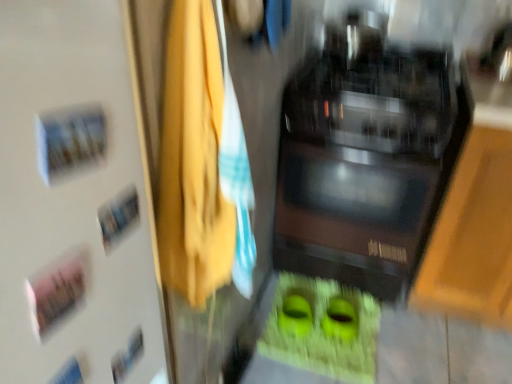
Question: Is yellow fabric at center located outside black glossy microwave at center?

Choices:
 (A) yes
 (B) no

Answer: (A)

Question: From a real-world perspective, is yellow fabric at center positioned over black glossy microwave at center based on gravity?

Choices:
 (A) yes
 (B) no

Answer: (A)

Question: Is yellow fabric at center turned away from black glossy microwave at center?

Choices:
 (A) no
 (B) yes

Answer: (A)

Question: From the image's perspective, is yellow fabric at center on black glossy microwave at center?

Choices:
 (A) no
 (B) yes

Answer: (A)

Question: Considering the relative sizes of yellow fabric at center and black glossy microwave at center in the image provided, is yellow fabric at center wider than black glossy microwave at center?

Choices:
 (A) yes
 (B) no

Answer: (B)

Question: Considering the positions of black glossy microwave at center and white matte door at upper left in the image, is black glossy microwave at center wider or thinner than white matte door at upper left?

Choices:
 (A) thin
 (B) wide

Answer: (B)

Question: Considering their positions, is black glossy microwave at center located in front of or behind white matte door at upper left?

Choices:
 (A) behind
 (B) front

Answer: (A)

Question: In terms of height, does black glossy microwave at center look taller or shorter compared to white matte door at upper left?

Choices:
 (A) tall
 (B) short

Answer: (A)

Question: Based on their sizes in the image, would you say black glossy microwave at center is bigger or smaller than white matte door at upper left?

Choices:
 (A) big
 (B) small

Answer: (A)

Question: Considering their positions, is white matte door at upper left located in front of or behind yellow fabric at center?

Choices:
 (A) behind
 (B) front

Answer: (B)

Question: Is point (25, 218) positioned closer to the camera than point (246, 258)?

Choices:
 (A) farther
 (B) closer

Answer: (B)

Question: Is white matte door at upper left bigger or smaller than yellow fabric at center?

Choices:
 (A) small
 (B) big

Answer: (A)

Question: In terms of height, does white matte door at upper left look taller or shorter compared to yellow fabric at center?

Choices:
 (A) tall
 (B) short

Answer: (B)

Question: Is point (175, 226) positioned closer to the camera than point (320, 124)?

Choices:
 (A) closer
 (B) farther

Answer: (A)

Question: From the image's perspective, relative to black glossy microwave at center, is yellow fabric at center above or below?

Choices:
 (A) above
 (B) below

Answer: (B)